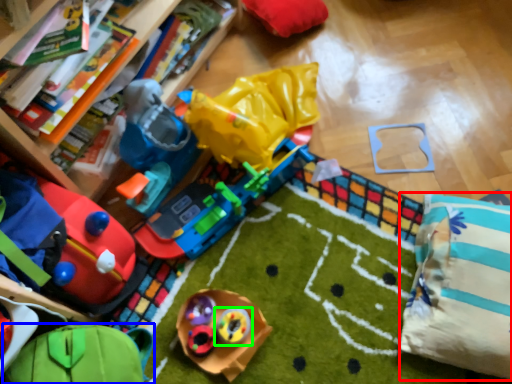
Question: Estimate the real-world distances between objects in this image. Which object is farther from pillow (highlighted by a red box), toy (highlighted by a blue box) or toy (highlighted by a green box)?

Choices:
 (A) toy
 (B) toy

Answer: (A)